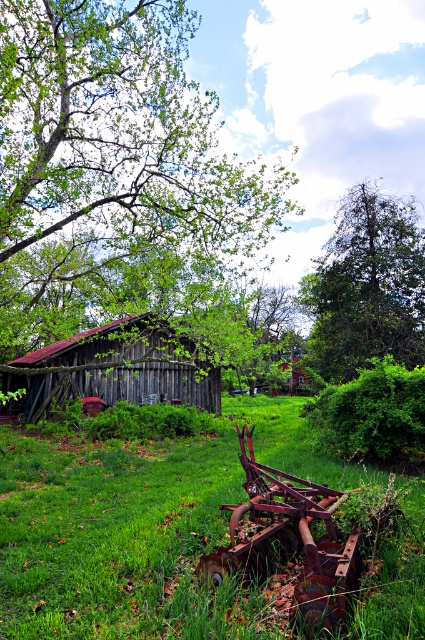
You are a painter setting up an easel to capture this rural scene. You want to ensure that the green leafy tree at upper left and the green grassy at lower center are both visible in your painting. Given their widths, which object should you place closer to the edge of the canvas to maintain balance?

The green leafy tree at upper left is wider than the green grassy at lower center. To maintain balance, you should place the wider green leafy tree at upper left closer to the edge of the canvas so that its greater width doesn

You are a bird seeking shelter. You notice two trees in the image, the green leafy tree at upper left and the green leafy tree at upper center. Which tree would provide more coverage for nesting?

The green leafy tree at upper left is bigger than the green leafy tree at upper center, so it would provide more coverage for nesting.